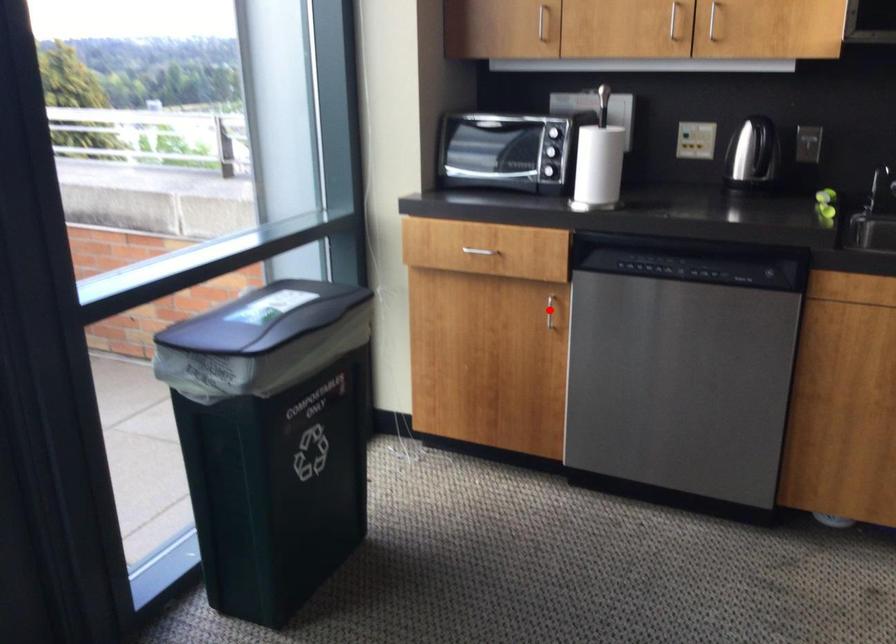
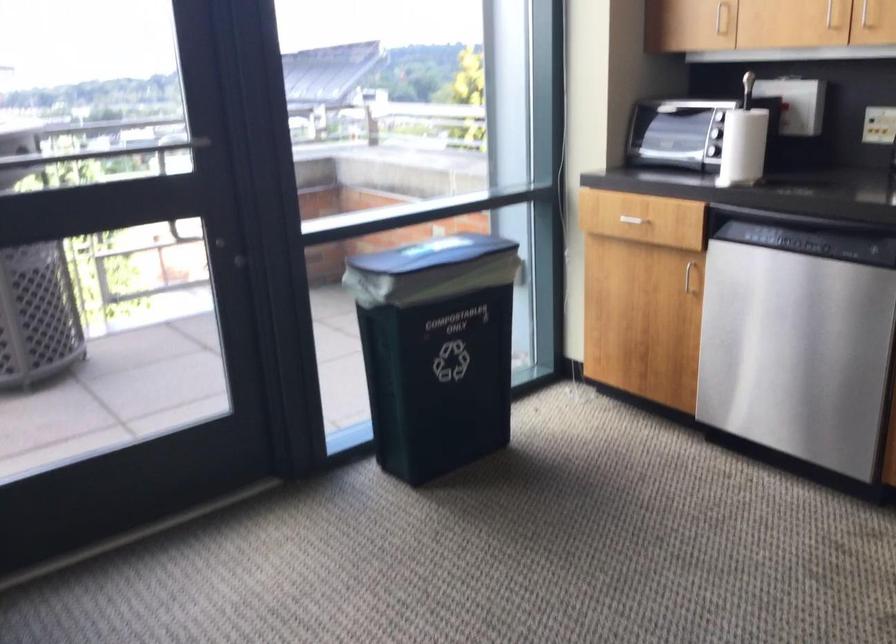
Question: I am providing you with two images of the same scene from different viewpoints. In image1, a red point is highlighted. Considering the same 3D point in image2, which of the following is correct?

Choices:
 (A) It is closer
 (B) It is farther

Answer: (B)